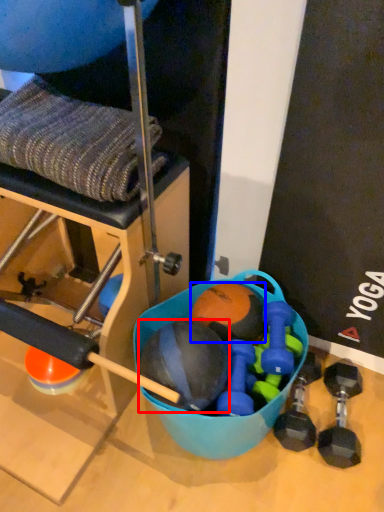
Question: Which point is closer to the camera, ball (highlighted by a red box) or ball (highlighted by a blue box)?

Choices:
 (A) ball
 (B) ball

Answer: (A)